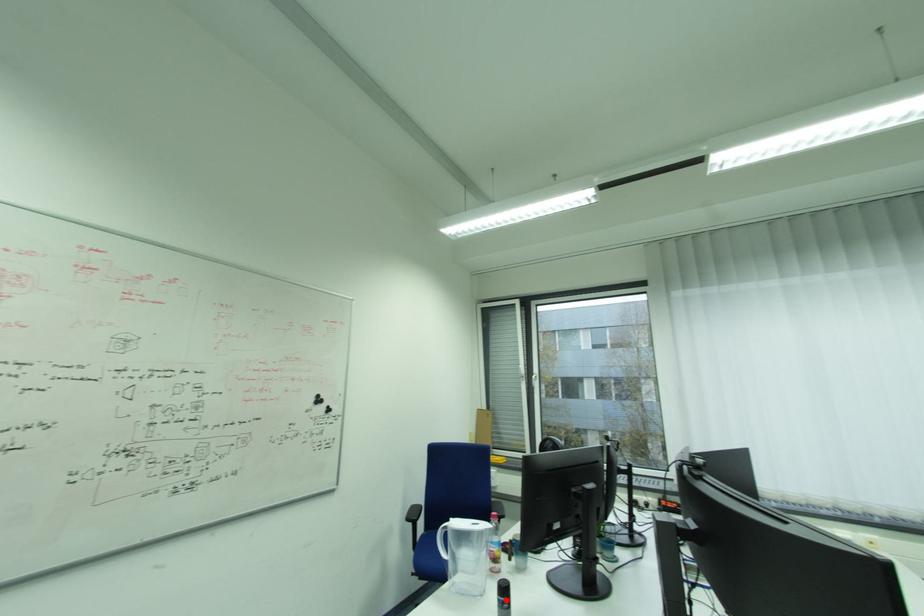
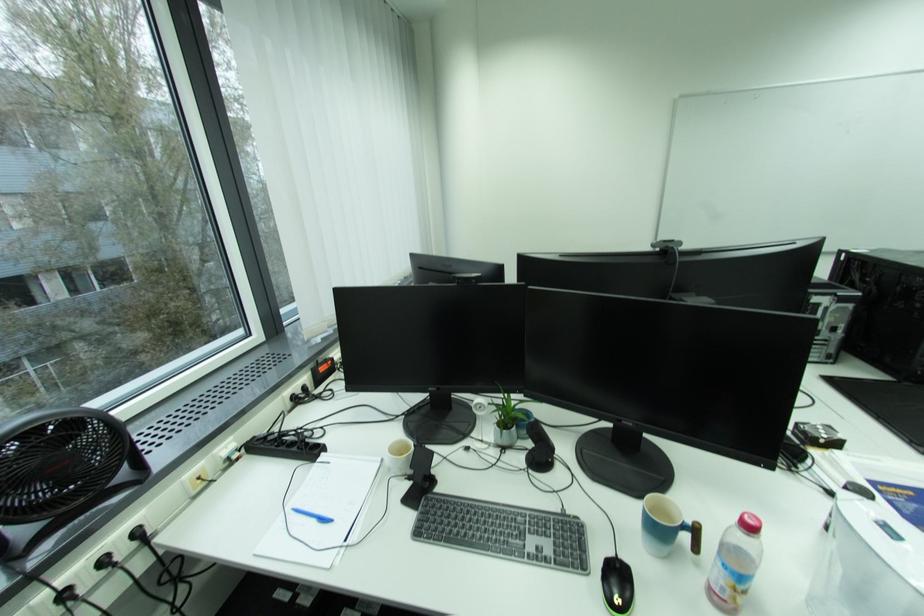
Question: I am providing you with two images of the same scene from different viewpoints. A red point is marked on the first image. Is the red point's position out of view in image 2?

Choices:
 (A) Yes
 (B) No

Answer: (A)